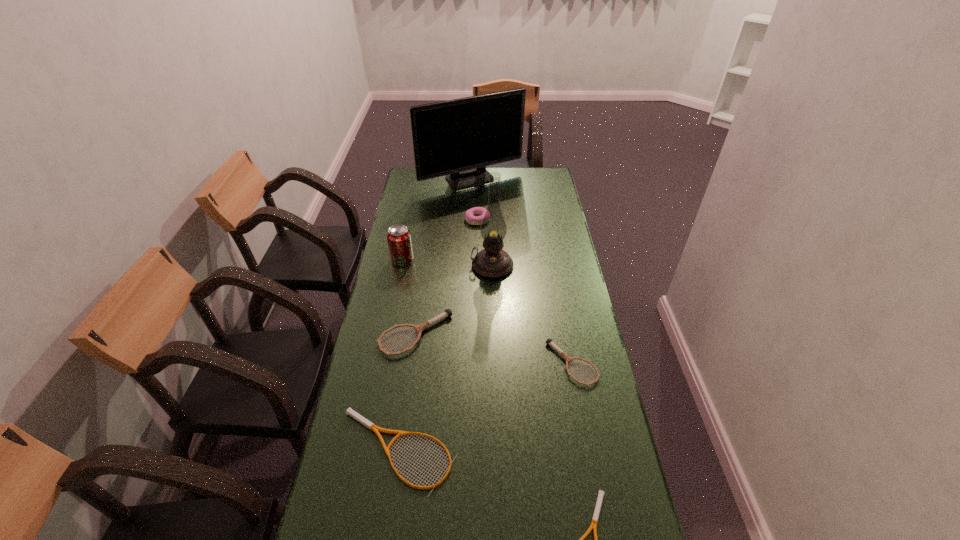
At what (x,y) coordinates should I click in order to perform the action: click on the bigger beige tennis racket. Please return your answer as a coordinate pair (x, y). The width and height of the screenshot is (960, 540). Looking at the image, I should click on (349, 411).

At what (x,y) coordinates should I click in order to perform the action: click on vacant space located on the front-facing side of the computer monitor. Please return your answer as a coordinate pair (x, y). The image size is (960, 540). Looking at the image, I should click on (469, 242).

I want to click on free space located 0.090m on the back of the oil lamp, so click(x=492, y=240).

Locate an element on the screen. vacant region located on the back of the third tallest object is located at coordinates (406, 241).

The width and height of the screenshot is (960, 540). I want to click on vacant space located 0.120m on the front of the second farthest object, so click(477, 244).

Locate an element on the screen. free space located on the back of the bigger gray tennis racket is located at coordinates (426, 262).

The image size is (960, 540). I want to click on vacant space situated on the front of the sixth tallest object, so click(580, 406).

I want to click on vacant area situated 0.070m on the back of the left beige tennis racket, so click(407, 389).

Locate an element on the screen. object that is positioned at the far edge is located at coordinates (458, 138).

You are a GUI agent. You are given a task and a screenshot of the screen. Output one action in this format:
    pyautogui.click(x=<x>, y=<y>)
    Task: Click on the computer monitor located in the left edge section of the desktop
    The image size is (960, 540).
    Given the screenshot: What is the action you would take?
    pyautogui.click(x=458, y=138)